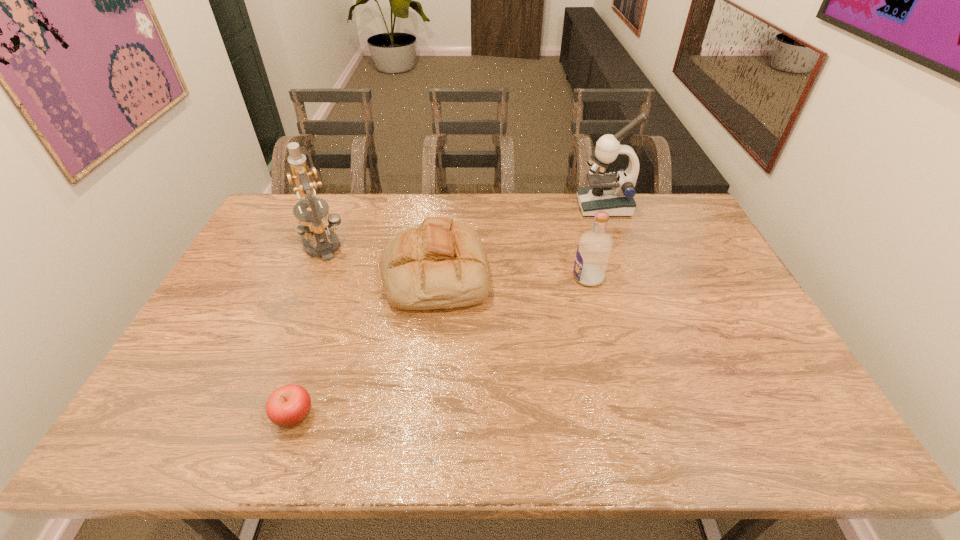
Image resolution: width=960 pixels, height=540 pixels. What are the coordinates of `vacant area between the bread and the nearest object` in the screenshot? It's located at (365, 345).

In order to click on vacant space in between the apple and the vodka in this screenshot , I will do `click(441, 346)`.

I want to click on free point between the third object from right to left and the left microscope, so click(378, 260).

This screenshot has width=960, height=540. What are the coordinates of `vacant area that lies between the bread and the right microscope` in the screenshot? It's located at (520, 240).

You are a GUI agent. You are given a task and a screenshot of the screen. Output one action in this format:
    pyautogui.click(x=<x>, y=<y>)
    Task: Click on the blank region between the apple and the nearer microscope
    The width and height of the screenshot is (960, 540).
    Given the screenshot: What is the action you would take?
    pyautogui.click(x=307, y=330)

Image resolution: width=960 pixels, height=540 pixels. Find the location of `the fourth closest object relative to the fourth tallest object`. the fourth closest object relative to the fourth tallest object is located at coordinates (612, 193).

Locate which object ranks in proximity to the apple. Please provide its 2D coordinates. Your answer should be formatted as a tuple, i.e. [(x, y)], where the tuple contains the x and y coordinates of a point satisfying the conditions above.

[(441, 263)]

This screenshot has height=540, width=960. Identify the location of free space in the image that satisfies the following two spatial constraints: 1. on the back side of the farthest object; 2. on the right side of the left microscope. (337, 206).